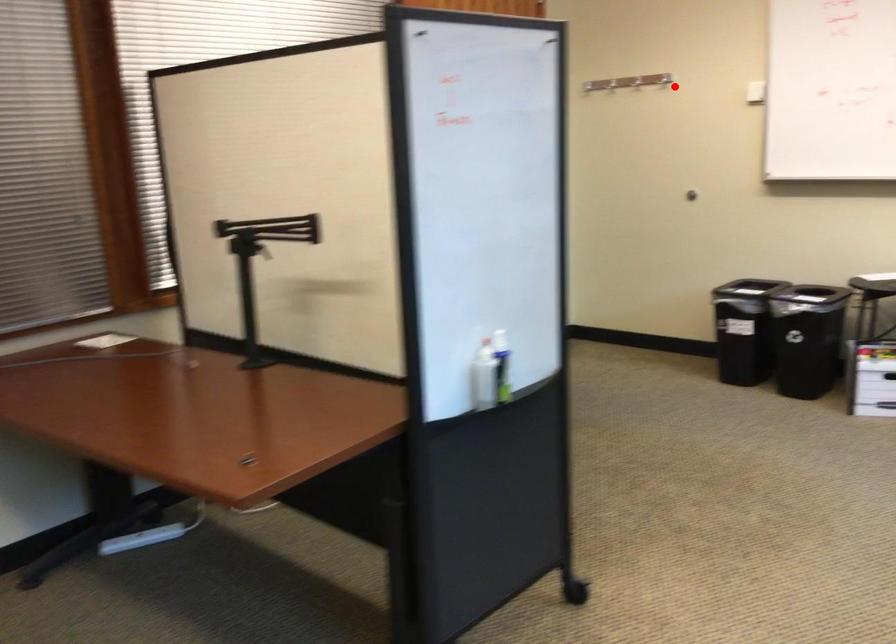
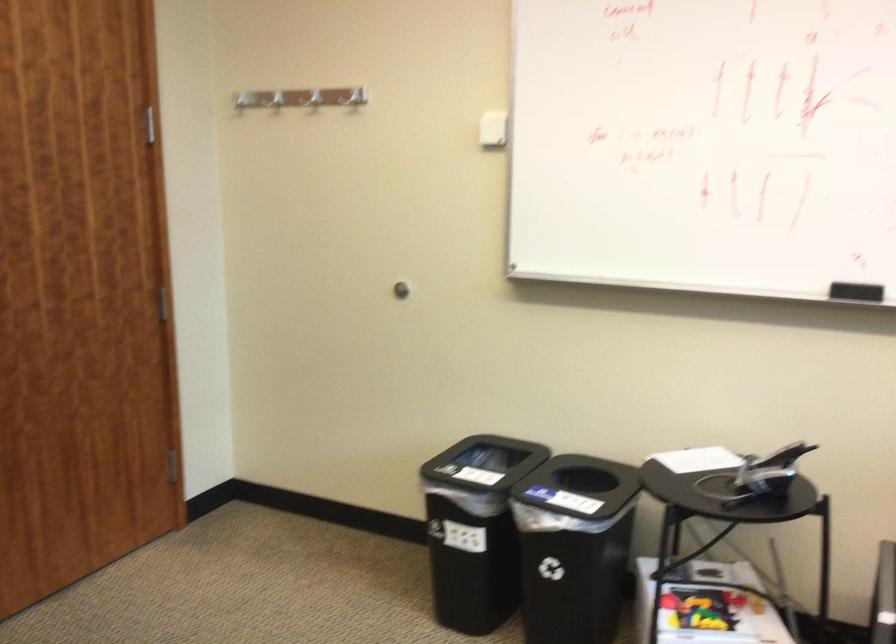
The point at the highlighted location is marked in the first image. Where is the corresponding point in the second image?

(493, 129)